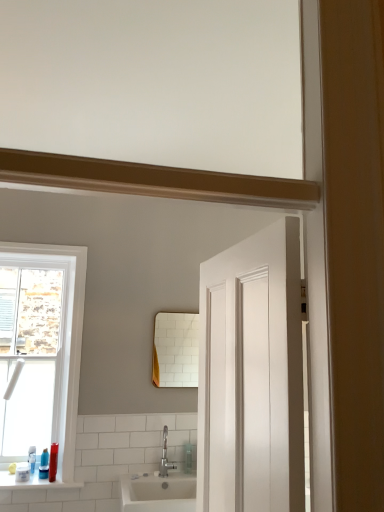
Where is `vacant space in front of silver metallic faucet at lower center`? vacant space in front of silver metallic faucet at lower center is located at coordinates (173, 482).